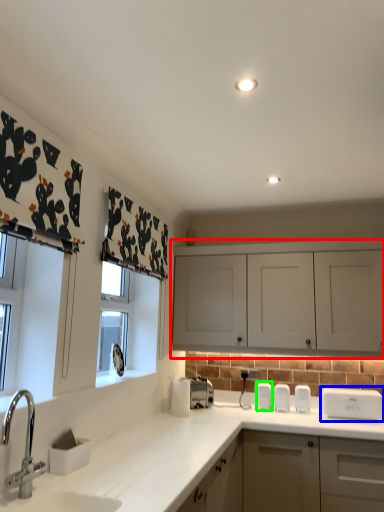
Question: Based on their relative distances, which object is farther from cabinetry (highlighted by a red box)? Choose from appliance (highlighted by a blue box) and appliance (highlighted by a green box).

Choices:
 (A) appliance
 (B) appliance

Answer: (B)